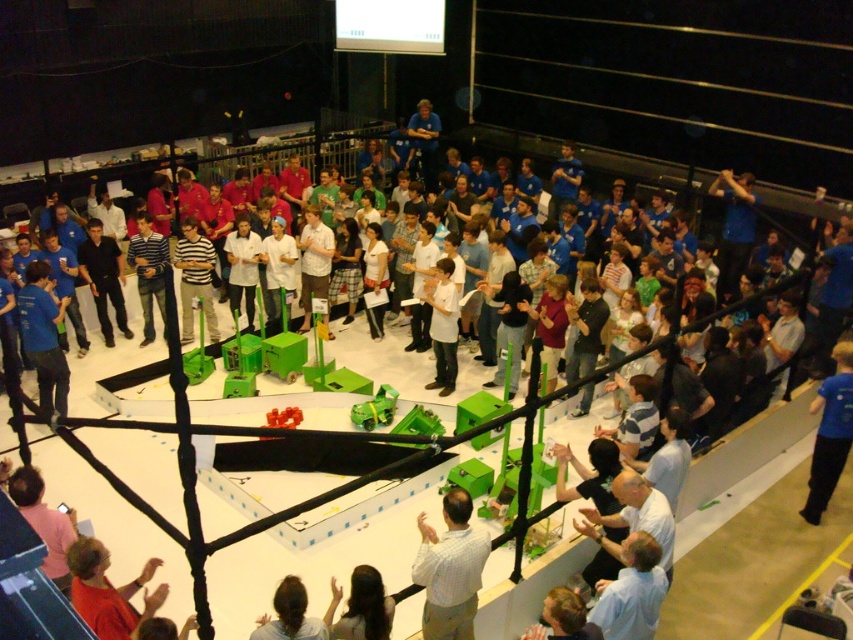
Is point (485, 536) closer to camera compared to point (572, 177)?

Yes, point (485, 536) is closer to viewer.

Is light brown shirt at center to the left of blue shirt at center from the viewer's perspective?

Correct, you'll find light brown shirt at center to the left of blue shirt at center.

What are the coordinates of `light brown shirt at center` in the screenshot? It's located at (450, 570).

Identify the location of light brown shirt at center. The image size is (853, 640). (450, 570).

Is light blue shirt at center thinner than blue matte shirt at upper right?

Indeed, light blue shirt at center has a lesser width compared to blue matte shirt at upper right.

Is light blue shirt at center closer to camera compared to blue matte shirt at upper right?

Yes, it is in front of blue matte shirt at upper right.

Locate an element on the screen. Image resolution: width=853 pixels, height=640 pixels. light blue shirt at center is located at coordinates (634, 516).

Who is lower down, light blue shirt at center or blue shirt at center?

light blue shirt at center is lower down.

Consider the image. Between light blue shirt at center and blue shirt at center, which one appears on the right side from the viewer's perspective?

Positioned to the right is blue shirt at center.

Where is `light blue shirt at center`? The width and height of the screenshot is (853, 640). light blue shirt at center is located at coordinates point(634,516).

Where is `light blue shirt at center`? light blue shirt at center is located at coordinates (634, 516).